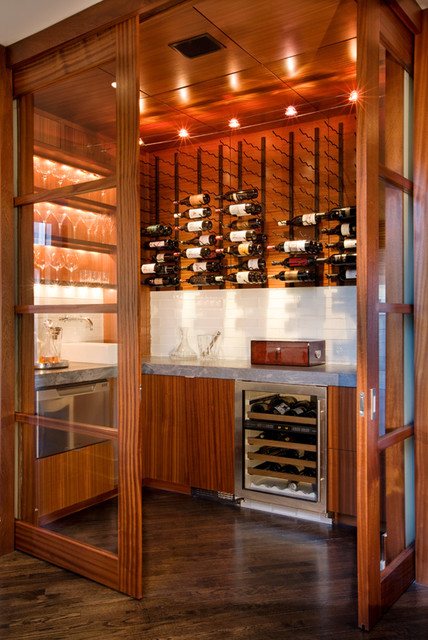
Image resolution: width=428 pixels, height=640 pixels. Identify the location of wine cabinet. (288, 418).